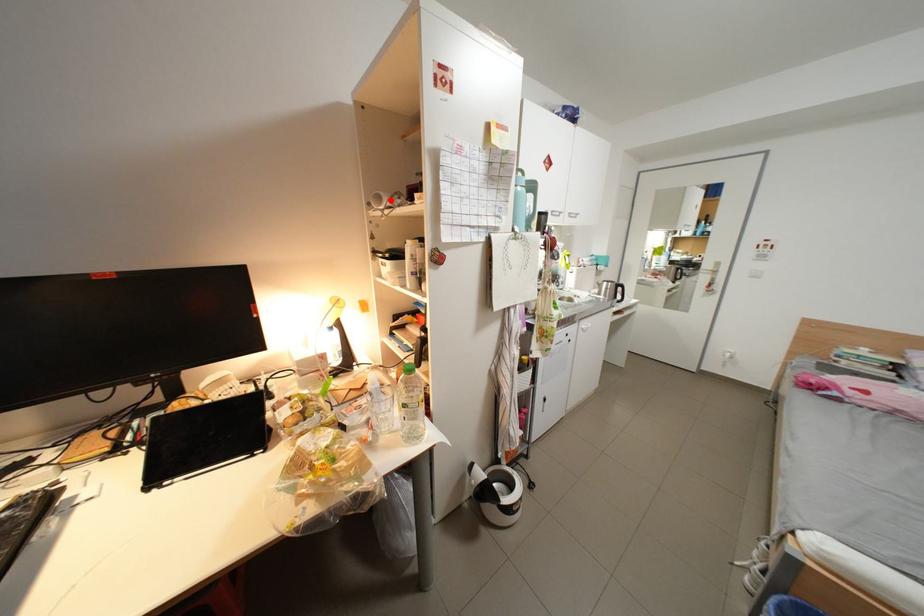
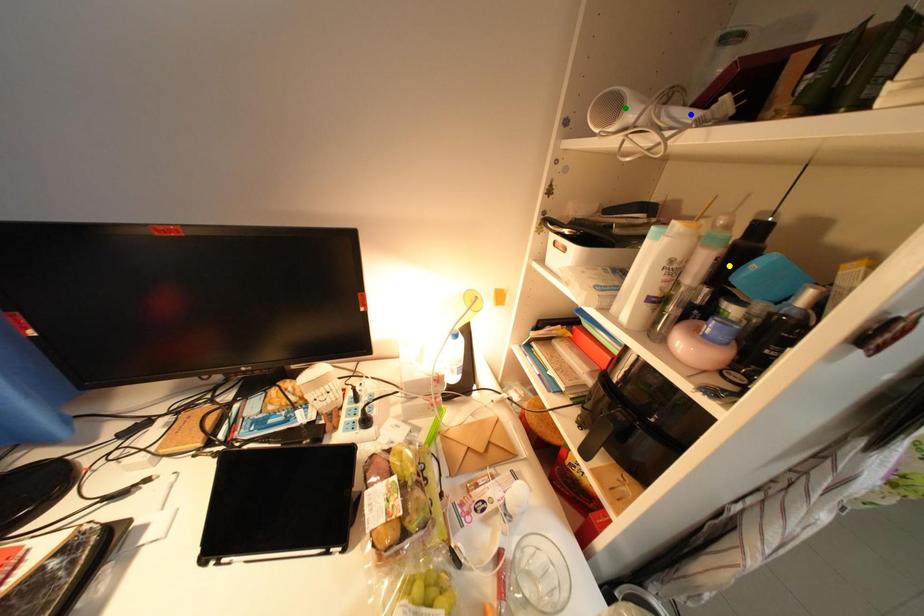
Question: I am providing you with two images of the same scene from different viewpoints. A red point is marked on the first image. You are given multiple points on the second image. Which point in image 2 is actually the same real-world point as the red point in image 1?

Choices:
 (A) green point
 (B) yellow point
 (C) blue point

Answer: (A)